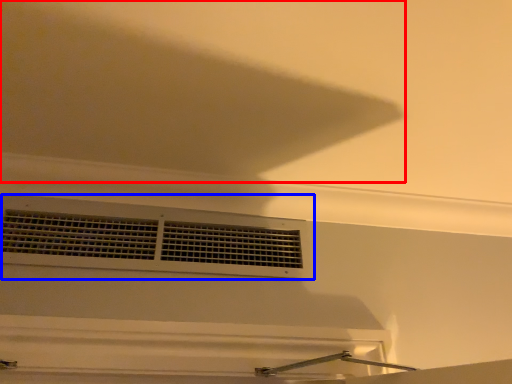
Question: Which of the following is the farthest to the observer, exhaust hood (highlighted by a red box) or window (highlighted by a blue box)?

Choices:
 (A) exhaust hood
 (B) window

Answer: (B)